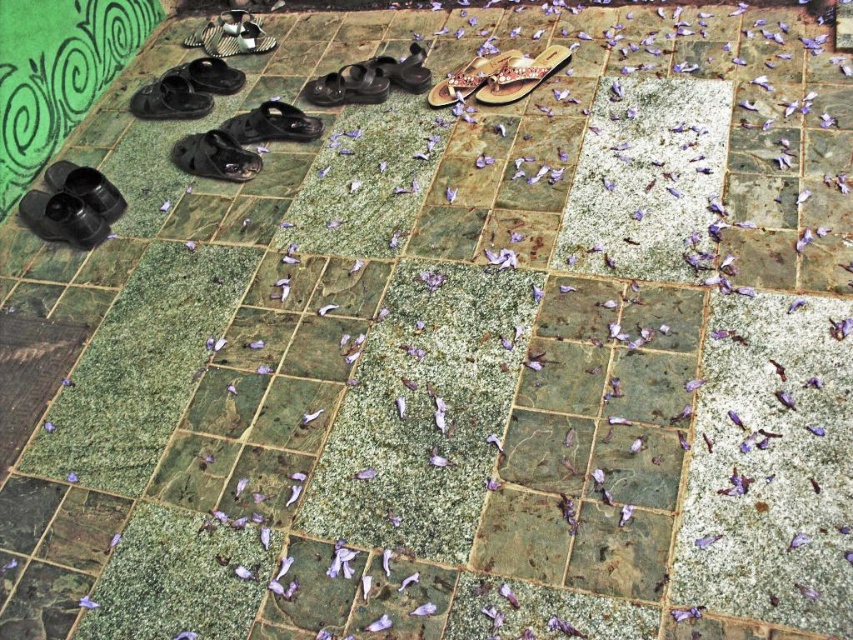
Question: Which point is closer to the camera taking this photo?

Choices:
 (A) (439, 96)
 (B) (219, 125)
 (C) (67, 202)

Answer: (C)

Question: Which object is the farthest from the matte black sandals at center?

Choices:
 (A) black rubber shoe at upper left
 (B) beige textured slipper at center
 (C) black matte shoe at center

Answer: (A)

Question: Observing the image, what is the correct spatial positioning of matte black sandal at center in reference to beige textured slipper at center?

Choices:
 (A) above
 (B) below

Answer: (B)

Question: Which is farther from the black matte shoe at upper left?

Choices:
 (A) beige textured slipper at center
 (B) shiny black shoe at lower left

Answer: (A)

Question: Does black matte shoe at center appear on the left side of matte black sandal at center?

Choices:
 (A) no
 (B) yes

Answer: (B)

Question: Does matte black sandals at center appear on the left side of shiny black shoe at lower left?

Choices:
 (A) yes
 (B) no

Answer: (B)